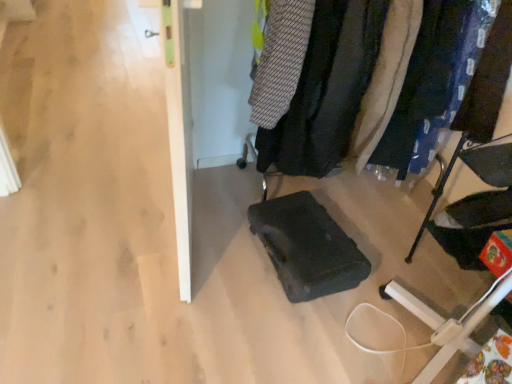
Question: Considering the relative sizes of velvet black coat at center and blue fabric pants at right, which appears as the fourth clothing when viewed from the left, in the image provided, is velvet black coat at center bigger than blue fabric pants at right, which appears as the fourth clothing when viewed from the left,?

Choices:
 (A) yes
 (B) no

Answer: (A)

Question: Would you say velvet black coat at center is outside blue fabric pants at right, which appears as the fourth clothing when viewed from the left?

Choices:
 (A) no
 (B) yes

Answer: (B)

Question: Is blue fabric pants at right, which appears as the fourth clothing when viewed from the left, a part of velvet black coat at center?

Choices:
 (A) no
 (B) yes

Answer: (B)

Question: Is velvet black coat at center oriented away from blue fabric pants at right, which is the first clothing in right-to-left order?

Choices:
 (A) yes
 (B) no

Answer: (A)

Question: Is velvet black coat at center facing towards blue fabric pants at right, which appears as the fourth clothing when viewed from the left?

Choices:
 (A) yes
 (B) no

Answer: (A)

Question: From the image's perspective, does velvet black coat at center appear lower than blue fabric pants at right, which is the first clothing in right-to-left order?

Choices:
 (A) yes
 (B) no

Answer: (A)

Question: Is blue fabric pants at right, which is the first clothing in right-to-left order, closer to the viewer compared to black fabric chair at lower right?

Choices:
 (A) yes
 (B) no

Answer: (B)

Question: Could you tell me if blue fabric pants at right, which appears as the fourth clothing when viewed from the left, is turned towards black fabric chair at lower right?

Choices:
 (A) no
 (B) yes

Answer: (B)

Question: From a real-world perspective, is blue fabric pants at right, which is the first clothing in right-to-left order, under black fabric chair at lower right?

Choices:
 (A) yes
 (B) no

Answer: (B)

Question: Is blue fabric pants at right, which is the first clothing in right-to-left order, positioned with its back to black fabric chair at lower right?

Choices:
 (A) no
 (B) yes

Answer: (A)

Question: Is the depth of blue fabric pants at right, which is the first clothing in right-to-left order, greater than that of black fabric chair at lower right?

Choices:
 (A) yes
 (B) no

Answer: (A)

Question: Are blue fabric pants at right, which is the first clothing in right-to-left order, and black fabric chair at lower right making contact?

Choices:
 (A) yes
 (B) no

Answer: (B)

Question: Would you say blue fabric pants at right, which is the first clothing in right-to-left order, is part of white textured fabric at center right, marked as the 2th clothing in a right-to-left arrangement,'s contents?

Choices:
 (A) no
 (B) yes

Answer: (A)